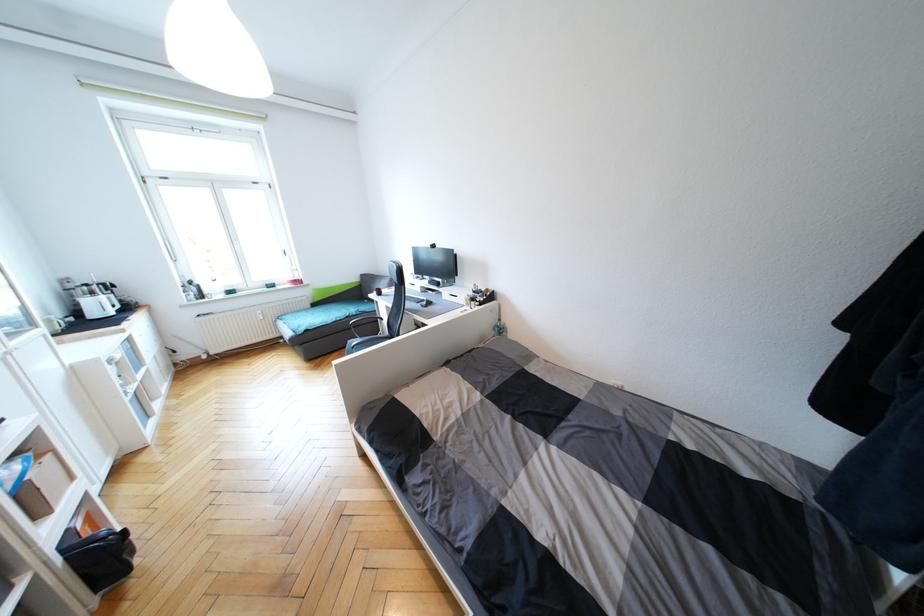
Describe the element at coordinates (365, 342) in the screenshot. I see `the black chair sitting surface` at that location.